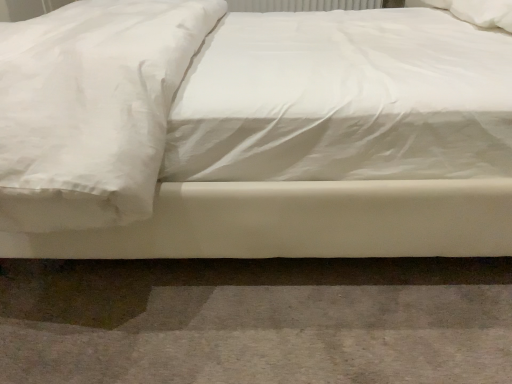
The width and height of the screenshot is (512, 384). Find the location of `white soft pillow at upper right`. white soft pillow at upper right is located at coordinates 479,11.

This screenshot has width=512, height=384. Describe the element at coordinates (479, 11) in the screenshot. I see `white soft pillow at upper right` at that location.

This screenshot has width=512, height=384. I want to click on white soft pillow at upper right, so click(479, 11).